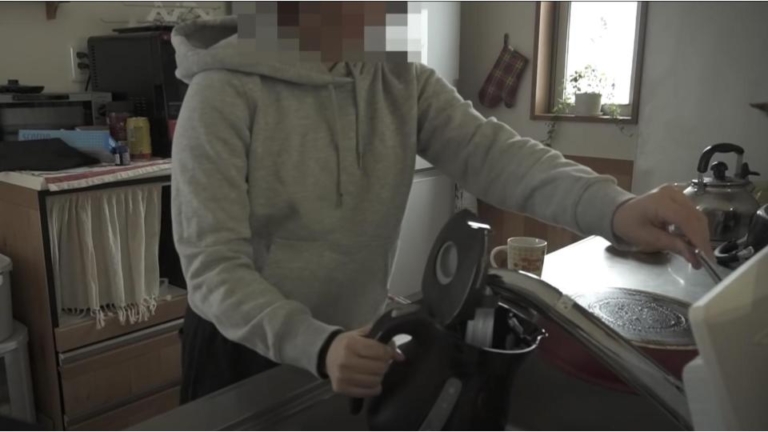
Where is `oven mit`? The image size is (768, 432). oven mit is located at coordinates (500, 81).